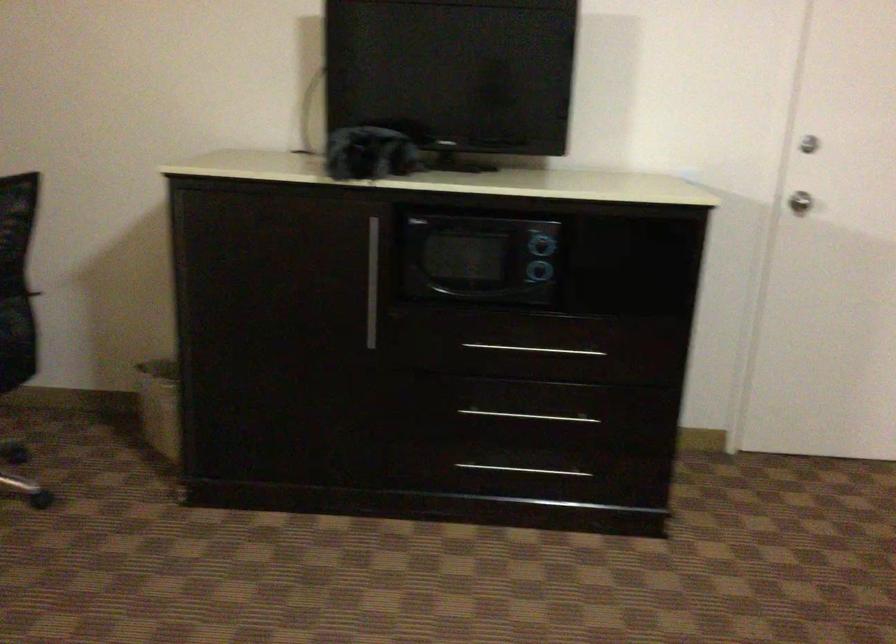
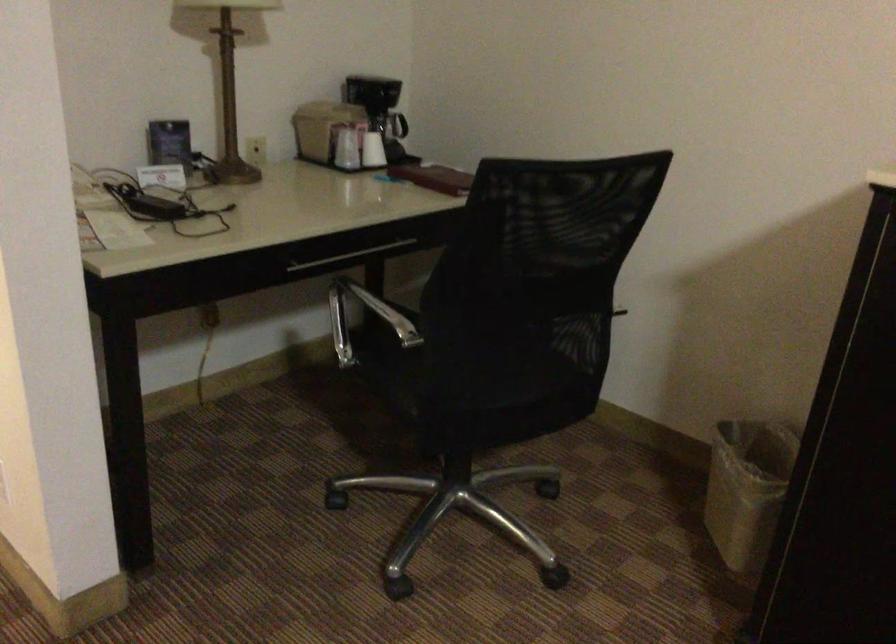
Question: The first image is from the beginning of the video and the second image is from the end. How did the camera likely rotate when shooting the video?

Choices:
 (A) Left
 (B) Right
 (C) Up
 (D) Down

Answer: (A)